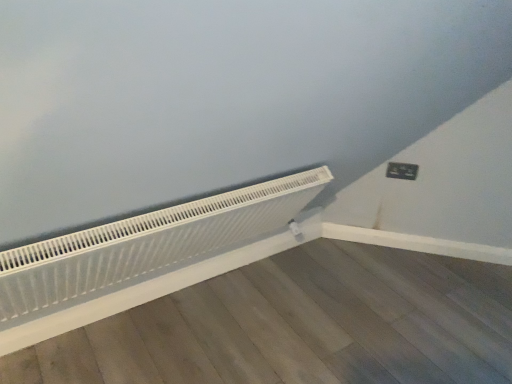
This screenshot has height=384, width=512. Find the location of `free spot in front of white matte radiator at lower left`. free spot in front of white matte radiator at lower left is located at coordinates (165, 337).